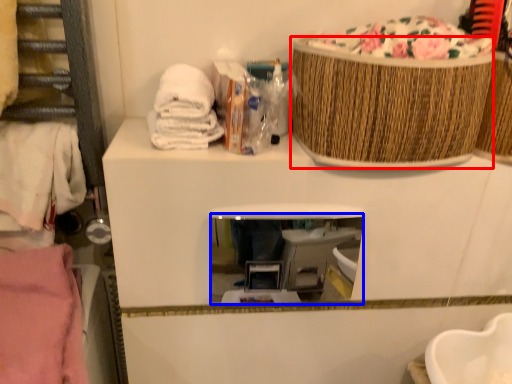
Question: Among these objects, which one is nearest to the camera, basket (highlighted by a red box) or mirror (highlighted by a blue box)?

Choices:
 (A) basket
 (B) mirror

Answer: (A)